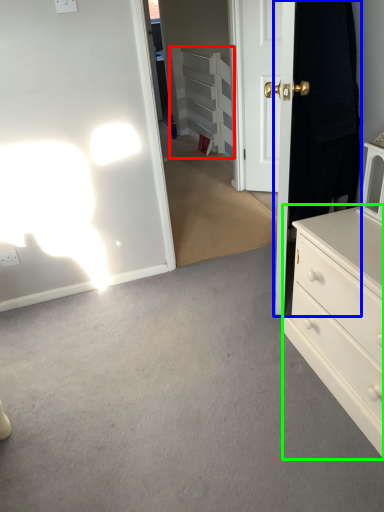
Question: Which object is positioned farthest from armoire (highlighted by a red box)? Select from door (highlighted by a blue box) and chest of drawers (highlighted by a green box).

Choices:
 (A) door
 (B) chest of drawers

Answer: (B)